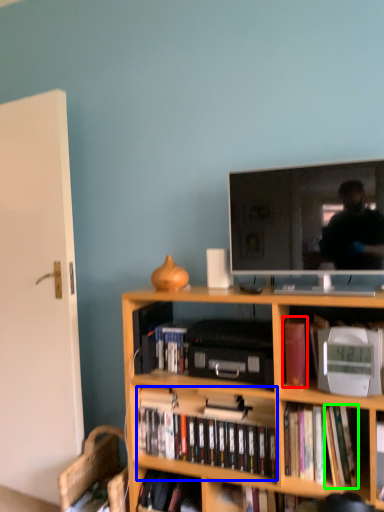
Question: Estimate the real-world distances between objects in this image. Which object is closer to book (highlighted by a red box), book (highlighted by a blue box) or paperback book (highlighted by a green box)?

Choices:
 (A) book
 (B) paperback book

Answer: (B)